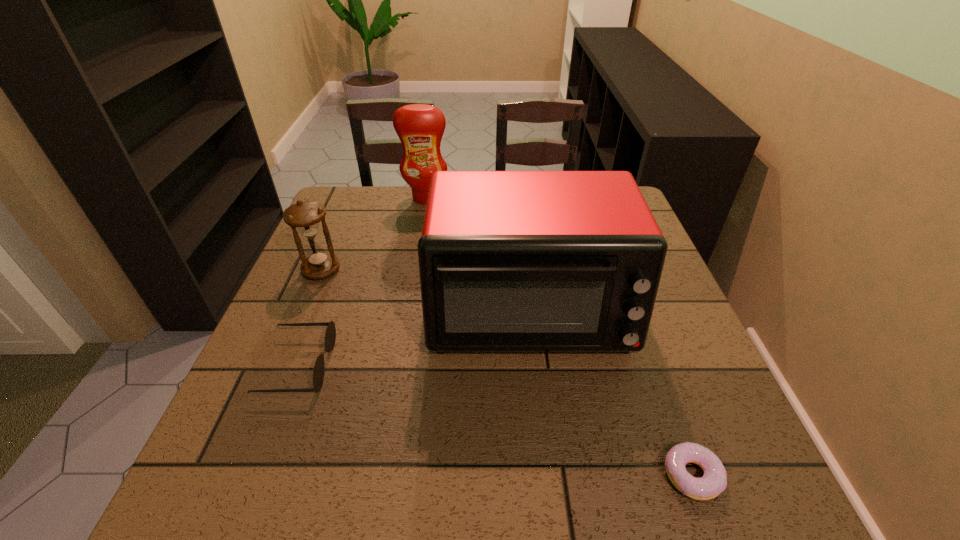
The height and width of the screenshot is (540, 960). I want to click on vacant space located on the left of the doughnut, so click(627, 475).

Locate an element on the screen. object that is at the far edge is located at coordinates (420, 127).

Where is `object that is positioned at the near edge`? This screenshot has width=960, height=540. object that is positioned at the near edge is located at coordinates (714, 481).

This screenshot has width=960, height=540. I want to click on hourglass present at the left edge, so click(305, 216).

Identify the location of sunglasses that is at the left edge. (330, 336).

At what (x,y) coordinates should I click in order to perform the action: click on toaster oven located at the right edge. Please return your answer as a coordinate pair (x, y). This screenshot has height=540, width=960. Looking at the image, I should click on (510, 261).

Locate an element on the screen. doughnut that is at the right edge is located at coordinates (714, 481).

The height and width of the screenshot is (540, 960). Find the location of `object that is at the near right corner`. object that is at the near right corner is located at coordinates (714, 481).

Locate an element on the screen. This screenshot has height=540, width=960. vacant space at the near edge is located at coordinates (574, 489).

Where is `vacant space at the left edge`? The image size is (960, 540). vacant space at the left edge is located at coordinates (364, 232).